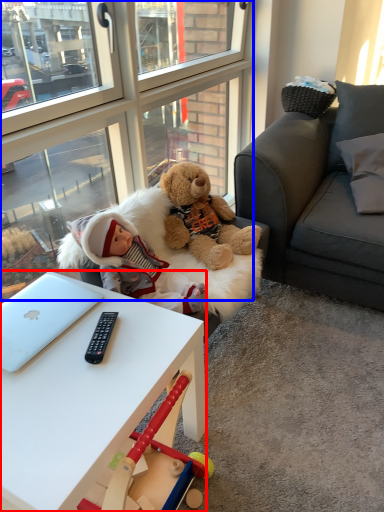
Question: Which point is further to the camera, desk (highlighted by a red box) or glass door (highlighted by a blue box)?

Choices:
 (A) desk
 (B) glass door

Answer: (B)